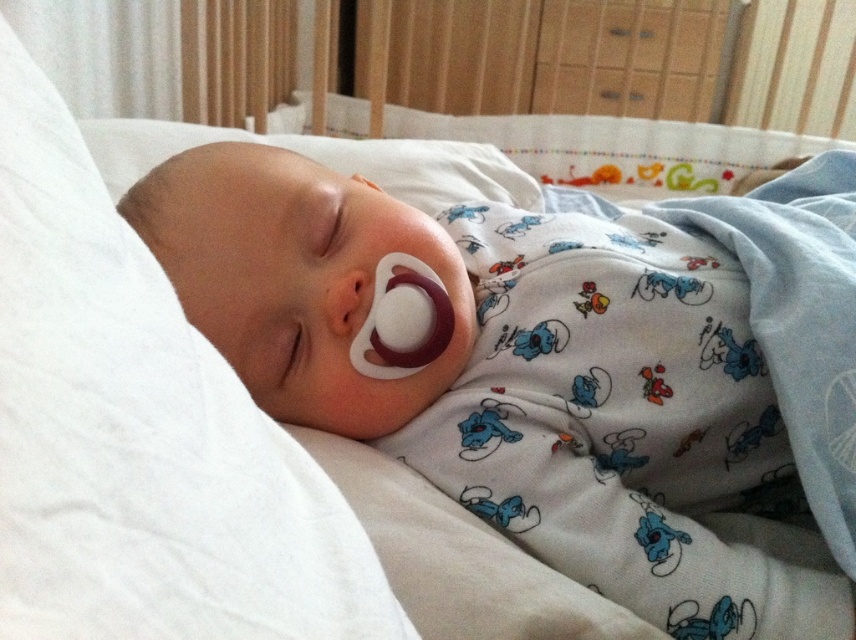
Question: Which of the following is the closest to the observer?

Choices:
 (A) (617, 232)
 (B) (280, 376)

Answer: (B)

Question: Can you confirm if white soft pacifier at center is positioned below smooth white pacifier at center?

Choices:
 (A) no
 (B) yes

Answer: (A)

Question: Is white soft pacifier at center smaller than smooth white pacifier at center?

Choices:
 (A) yes
 (B) no

Answer: (B)

Question: Is white soft pacifier at center smaller than smooth white pacifier at center?

Choices:
 (A) yes
 (B) no

Answer: (B)

Question: Which object is farther from the camera taking this photo?

Choices:
 (A) smooth white pacifier at center
 (B) white soft pacifier at center

Answer: (A)

Question: Which of the following is the farthest from the observer?

Choices:
 (A) (474, 432)
 (B) (289, 317)

Answer: (A)